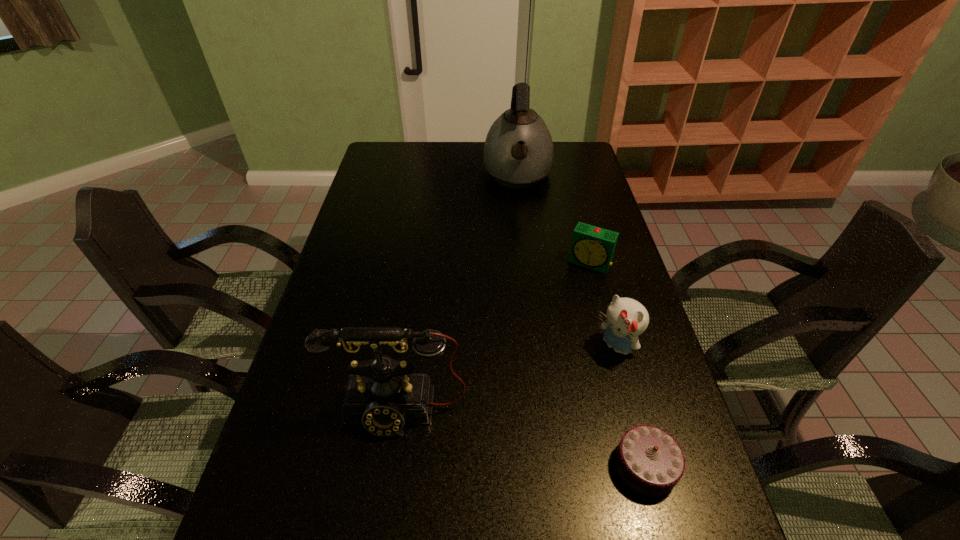
This screenshot has height=540, width=960. Find the location of `blank space at the right edge`. blank space at the right edge is located at coordinates (660, 380).

I want to click on vacant space at the far right corner, so click(x=558, y=154).

Find the location of `vacant space that's between the second farthest object and the tallest object`. vacant space that's between the second farthest object and the tallest object is located at coordinates (553, 219).

Find the location of a particular element. This screenshot has width=960, height=540. free spot between the kitten and the second shortest object is located at coordinates (602, 305).

Where is `empty space between the shortest object and the tallest object`? The width and height of the screenshot is (960, 540). empty space between the shortest object and the tallest object is located at coordinates pyautogui.click(x=582, y=321).

Identify the location of vacant area between the chocolate cake and the fourth shortest object. (522, 438).

At what (x,y) coordinates should I click in order to perform the action: click on vacant space that's between the telephone and the shortest object. Please return your answer as a coordinate pair (x, y). The image size is (960, 540). Looking at the image, I should click on (522, 438).

Identify the location of blank region between the chocolate cake and the kettle. (582, 321).

I want to click on empty space that is in between the chocolate cake and the tallest object, so click(x=582, y=321).

You are a GUI agent. You are given a task and a screenshot of the screen. Output one action in this format:
    pyautogui.click(x=<x>, y=<y>)
    Task: Click on the free space between the fourth tallest object and the leftmost object
    The width and height of the screenshot is (960, 540).
    Given the screenshot: What is the action you would take?
    pyautogui.click(x=494, y=337)